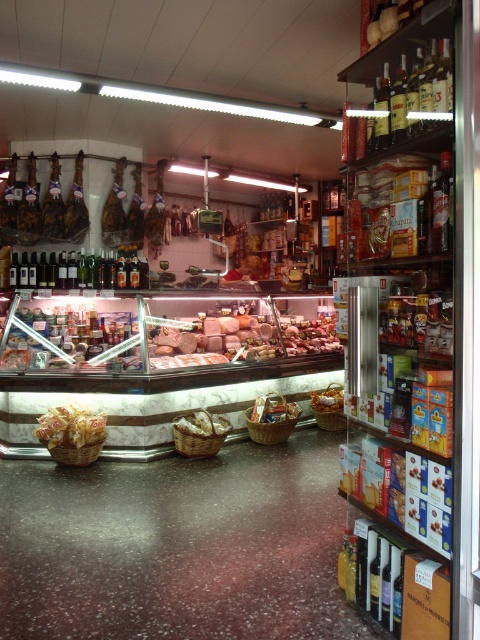
Can you confirm if yellow matte bread at center is positioned to the left of golden brown bread at center?

Correct, you'll find yellow matte bread at center to the left of golden brown bread at center.

Is yellow matte bread at center smaller than golden brown bread at center?

Incorrect, yellow matte bread at center is not smaller in size than golden brown bread at center.

Is point (94, 432) behind point (336, 404)?

No, (94, 432) is closer to viewer.

Find the location of a particular element. The width and height of the screenshot is (480, 640). yellow matte bread at center is located at coordinates (71, 428).

Which is more to the left, wooden shelves at right or yellow matte bread at center?

yellow matte bread at center

Is wooden shelves at right thinner than yellow matte bread at center?

Indeed, wooden shelves at right has a lesser width compared to yellow matte bread at center.

Who is more distant from viewer, [451,42] or [46,413]?

Positioned behind is point [46,413].

Image resolution: width=480 pixels, height=640 pixels. Find the location of `wooden shelves at right`. wooden shelves at right is located at coordinates (403, 330).

Does point (362, 436) come farther from viewer compared to point (288, 417)?

No, it is not.

Is wooden shelves at right positioned in front of wooden basket at center?

That is True.

The height and width of the screenshot is (640, 480). What do you see at coordinates (403, 330) in the screenshot? I see `wooden shelves at right` at bounding box center [403, 330].

The image size is (480, 640). I want to click on wooden shelves at right, so click(x=403, y=330).